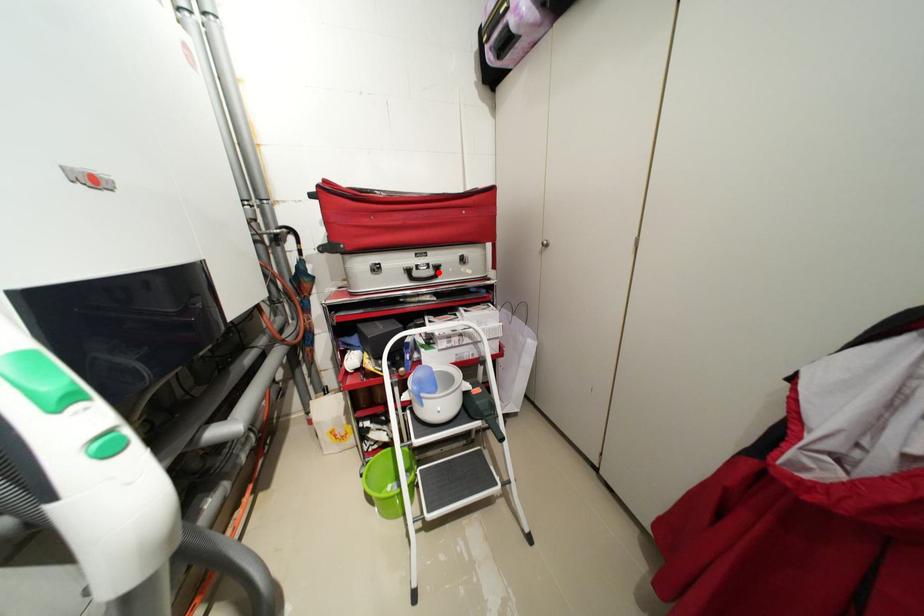
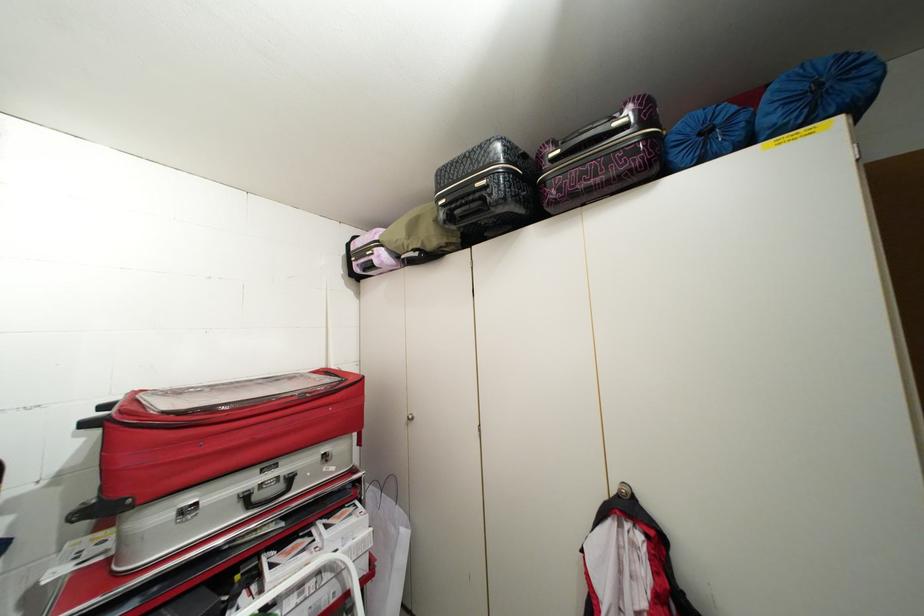
The point at the highlighted location is marked in the first image. Where is the corresponding point in the second image?

(287, 487)